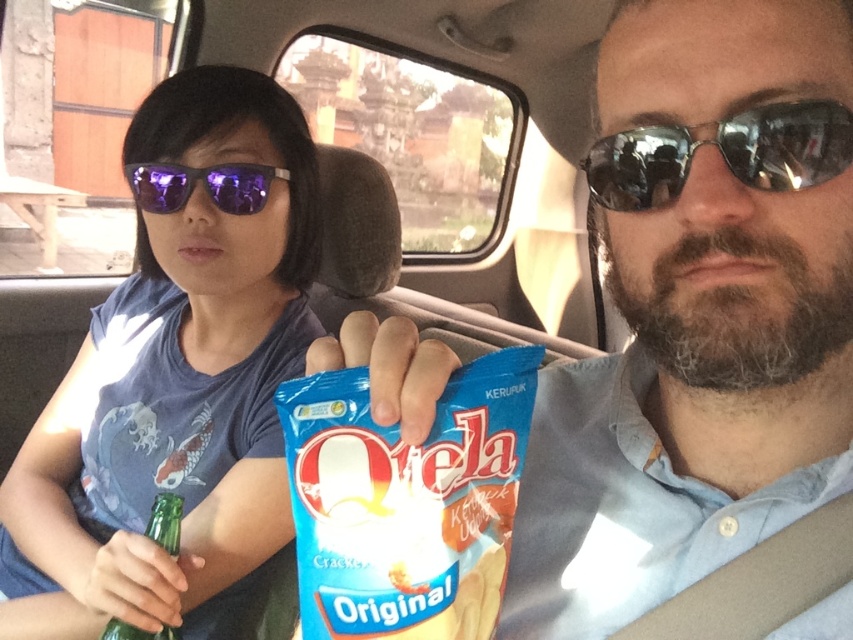
You are a delivery person who needs to place a small package between the purple reflective sunglasses at center and the green glass bottle at lower left in the car. Can you fit the package there?

The purple reflective sunglasses at center is larger than the green glass bottle at lower left, so there might not be enough space to fit the package between them.

You are a passenger in a car and need to hand a map to the driver. The driver is wearing a blue fabric shirt at left. Where should you hand the map to the driver?

The driver wearing the blue fabric shirt at left is located at position point (x=175, y=381), so you should hand the map to the driver at that position.